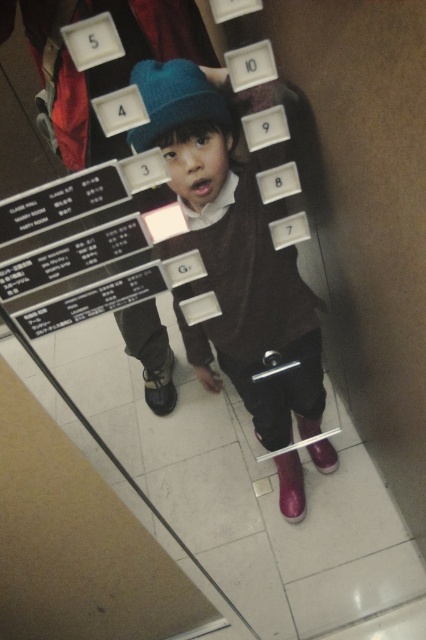
Question: Based on their relative distances, which object is nearer to the leather boot at lower center?

Choices:
 (A) teal knit hat at center
 (B) velvet brown sweater at center
 (C) shiny purple boot at lower center

Answer: (B)

Question: Which of the following is the closest to the observer?

Choices:
 (A) teal knit hat at center
 (B) shiny purple boot at lower center

Answer: (A)

Question: Is teal knit hat at center thinner than leather boot at lower center?

Choices:
 (A) yes
 (B) no

Answer: (B)

Question: Which of these objects is positioned farthest from the shiny purple shoe at lower center?

Choices:
 (A) teal knit hat at center
 (B) leather boot at lower center

Answer: (A)

Question: Can you confirm if teal knit hat at center is positioned above shiny purple boot at lower center?

Choices:
 (A) yes
 (B) no

Answer: (A)

Question: Is velvet brown sweater at center to the left of leather boot at lower center from the viewer's perspective?

Choices:
 (A) yes
 (B) no

Answer: (B)